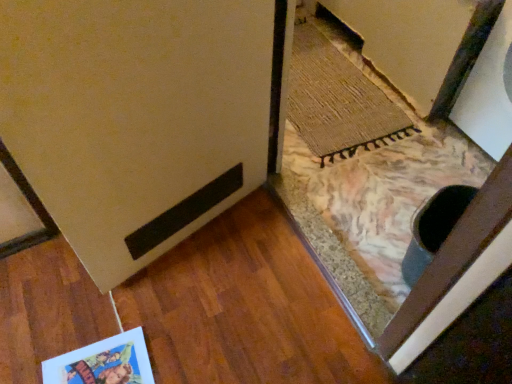
This screenshot has height=384, width=512. I want to click on free space in front of rug at lower right, so click(x=361, y=186).